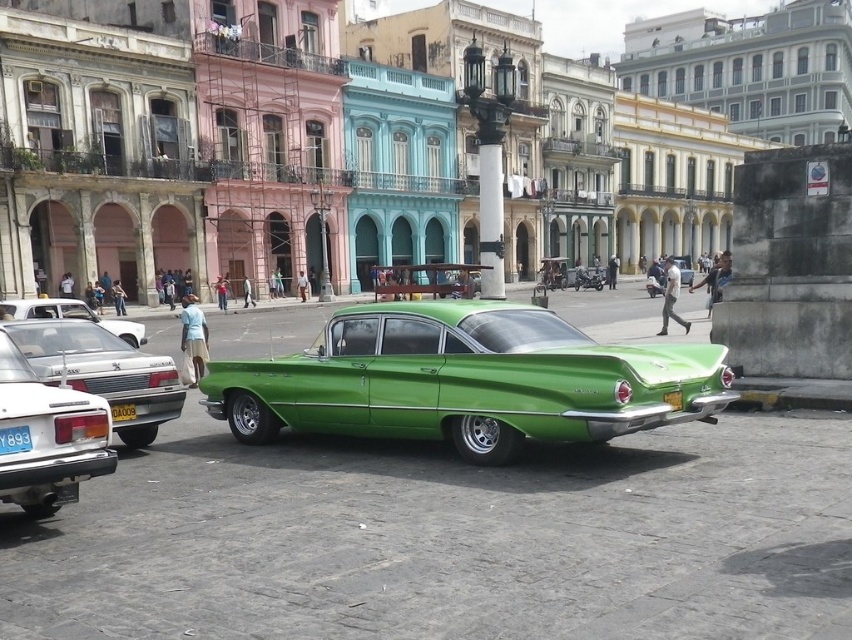
Who is positioned more to the left, green glossy car at center or yellow matte license plate at rear?

Positioned to the left is green glossy car at center.

Can you confirm if green glossy car at center is positioned above yellow matte license plate at rear?

Correct, green glossy car at center is located above yellow matte license plate at rear.

What do you see at coordinates (465, 380) in the screenshot? I see `green glossy car at center` at bounding box center [465, 380].

Where is `green glossy car at center`? green glossy car at center is located at coordinates (465, 380).

Who is more distant from viewer, (482,387) or (136,440)?

Point (136,440)

Describe the element at coordinates (465, 380) in the screenshot. I see `green glossy car at center` at that location.

Image resolution: width=852 pixels, height=640 pixels. Identify the location of green glossy car at center. (465, 380).

Who is positioned more to the left, matte silver sedan at left or yellow matte license plate at rear?

From the viewer's perspective, matte silver sedan at left appears more on the left side.

Between point (99, 317) and point (672, 401), which one is positioned behind?

The point (99, 317) is more distant.

Find the location of a particular element. matte silver sedan at left is located at coordinates (73, 316).